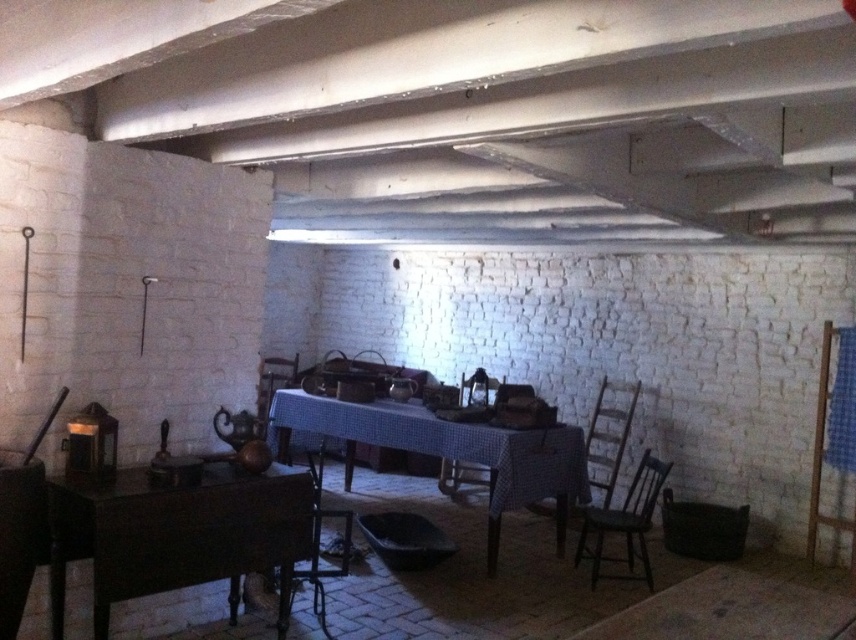
Does blue checkered tablecloth at center have a smaller size compared to wooden chair at center?

No, blue checkered tablecloth at center is not smaller than wooden chair at center.

Does point (369, 429) come in front of point (489, 396)?

Yes, point (369, 429) is in front of point (489, 396).

The image size is (856, 640). Identify the location of blue checkered tablecloth at center. (449, 451).

Is dark wood table at center to the left of blue checkered tablecloth at center from the viewer's perspective?

Indeed, dark wood table at center is positioned on the left side of blue checkered tablecloth at center.

You are a GUI agent. You are given a task and a screenshot of the screen. Output one action in this format:
    pyautogui.click(x=<x>, y=<y>)
    Task: Click on the dark wood table at center
    
    Given the screenshot: What is the action you would take?
    pyautogui.click(x=177, y=536)

This screenshot has width=856, height=640. Identify the location of dark wood table at center. (177, 536).

Does dark wood table at center appear on the right side of wooden chair at lower left?

Incorrect, dark wood table at center is not on the right side of wooden chair at lower left.

Does dark wood table at center appear on the left side of wooden chair at lower left?

Indeed, dark wood table at center is positioned on the left side of wooden chair at lower left.

Does point (277, 486) lie behind point (314, 508)?

No.

Locate an element on the screen. Image resolution: width=856 pixels, height=640 pixels. dark wood table at center is located at coordinates (177, 536).